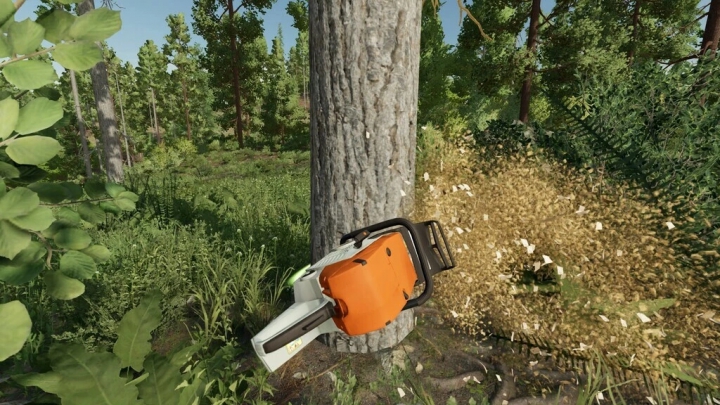
Locate an element on the screen. black handle is located at coordinates (428, 283).